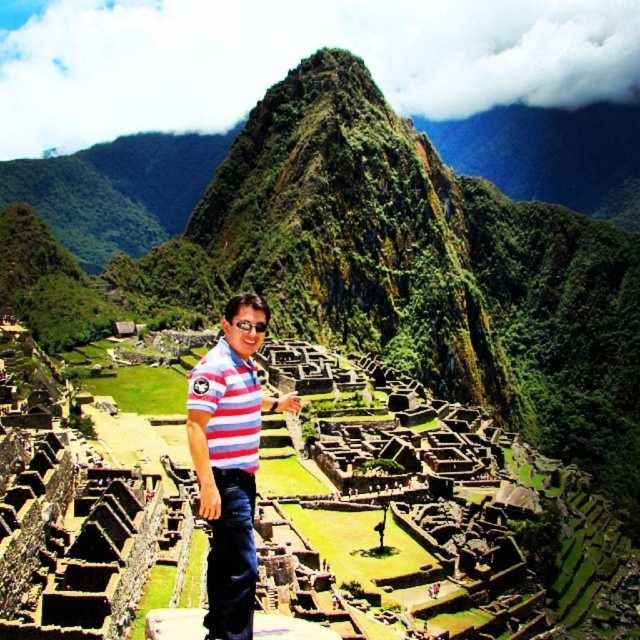
You are standing at the point with coordinates point (x=237, y=440) and want to walk to the point with coordinates point (x=244, y=556). Which direction should you move in relation to the scene?

You should move forward towards point (x=244, y=556) since it is in front of point (x=237, y=440).

You are a tour guide at Machu Picchu and notice two visitors wearing similar clothing. One is wearing a striped cotton shirt at center and the other a striped cotton polo shirt at center. Which visitor is wearing the larger garment?

The striped cotton shirt at center is larger in size than the striped cotton polo shirt at center, so the visitor wearing the striped cotton shirt at center has the larger garment.

You are a photographer at Machu Picchu and want to capture both the striped cotton shirt at center and the striped cotton polo shirt at center in the same frame. Which one should you position on the left side of your camera viewfinder to include both?

To include both the striped cotton shirt at center and the striped cotton polo shirt at center in the same frame, you should position the striped cotton polo shirt at center on the left side of your camera viewfinder since it is to the left of the striped cotton shirt at center.